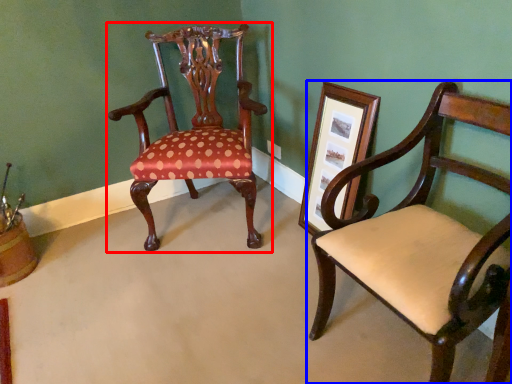
Question: Among these objects, which one is nearest to the camera, chair (highlighted by a red box) or chair (highlighted by a blue box)?

Choices:
 (A) chair
 (B) chair

Answer: (B)